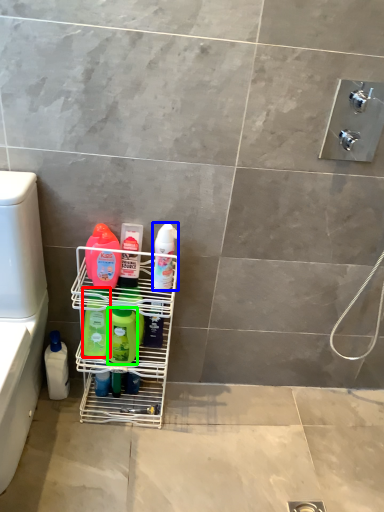
Question: Considering the real-world distances, which object is farthest from cleaning product (highlighted by a red box)? cleaning product (highlighted by a blue box) or cleaning product (highlighted by a green box)?

Choices:
 (A) cleaning product
 (B) cleaning product

Answer: (A)